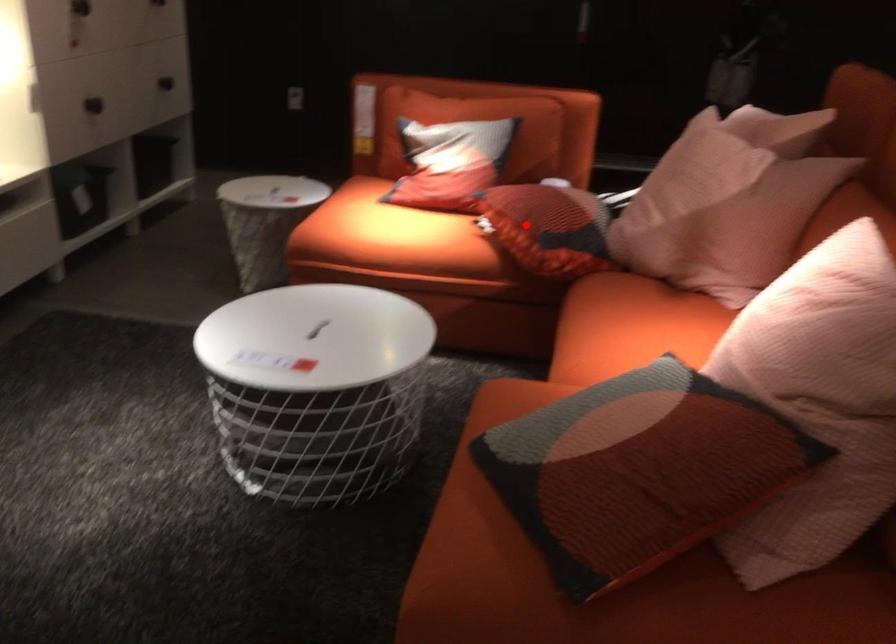
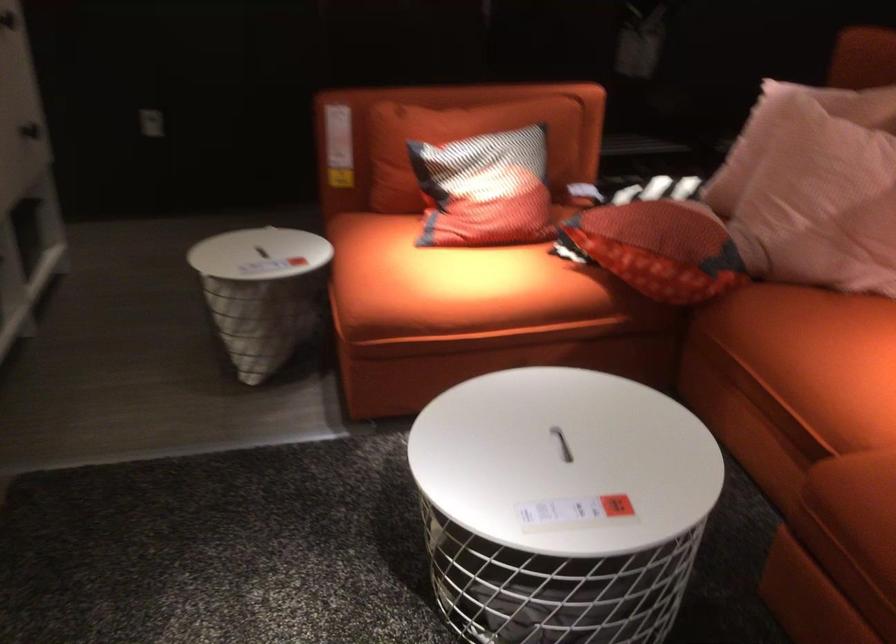
Question: I am providing you with two images of the same scene from different viewpoints. Image1 has a red point marked. In image2, the corresponding 3D location appears at what relative position? Reply with the corresponding letter.

Choices:
 (A) Closer
 (B) Farther

Answer: (A)